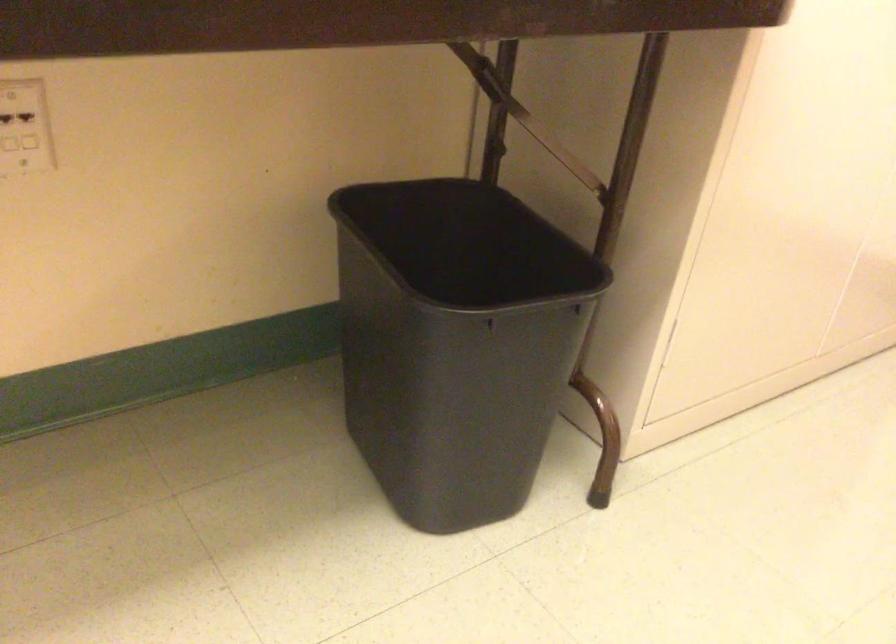
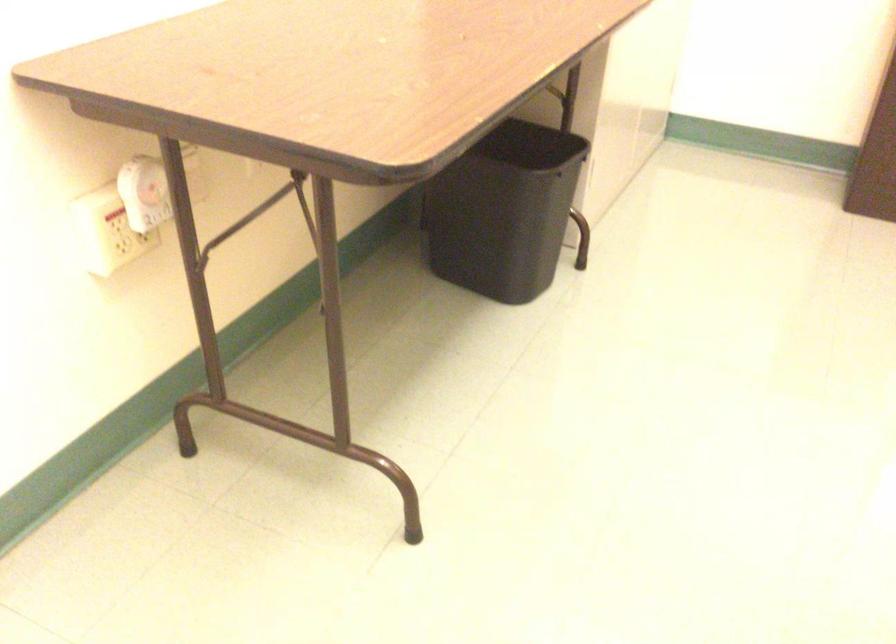
Locate, in the second image, the point that corresponds to pixel 409 364 in the first image.

(504, 211)